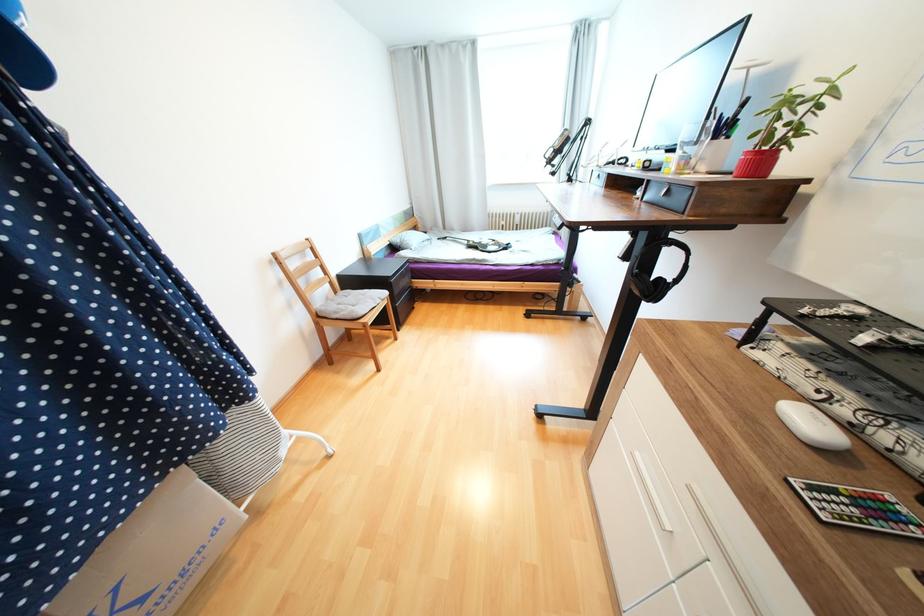
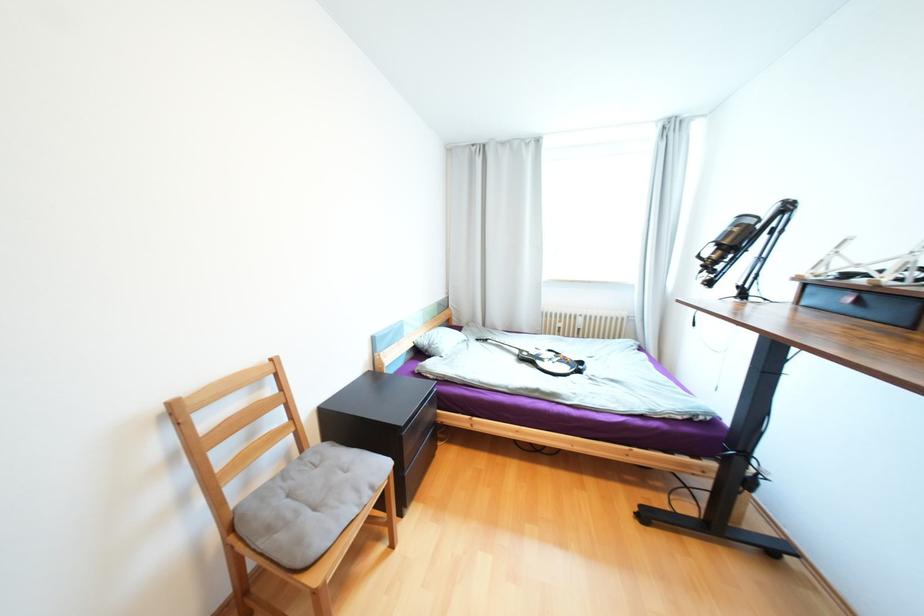
Question: What movement of the cameraman would produce the second image?

Choices:
 (A) Left
 (B) Right
 (C) Forward
 (D) Backward

Answer: (C)